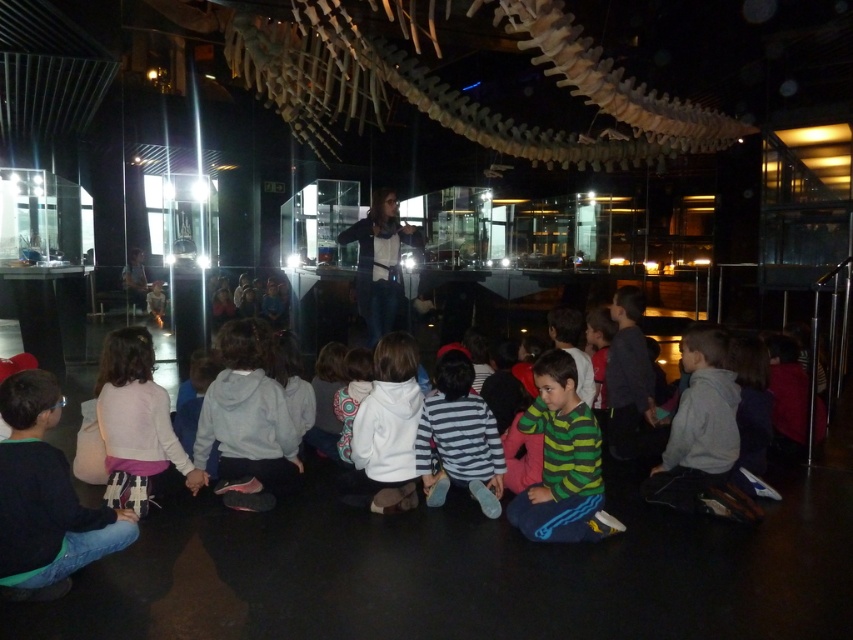
You are a photographer trying to capture a group photo of the striped cotton shirt at center and the white fleece jacket at center. Since you want to ensure both are clearly visible, which clothing item should you focus on first considering their sizes?

The striped cotton shirt at center is wider than the white fleece jacket at center, so focusing on the striped cotton shirt at center first would ensure it is captured clearly due to its larger size.

You are a photographer trying to capture a group photo of the children and the presenter. You need to ensure that both the gray hoodie at lower right and the striped cotton shirt at center are clearly visible in the photo. Considering their sizes, which clothing item might require you to adjust your camera angle to avoid blocking the other?

The gray hoodie at lower right is bigger than the striped cotton shirt at center, so adjusting the camera angle to position the larger gray hoodie at lower right slightly behind or to the side of the smaller striped cotton shirt at center would prevent it from blocking the view.